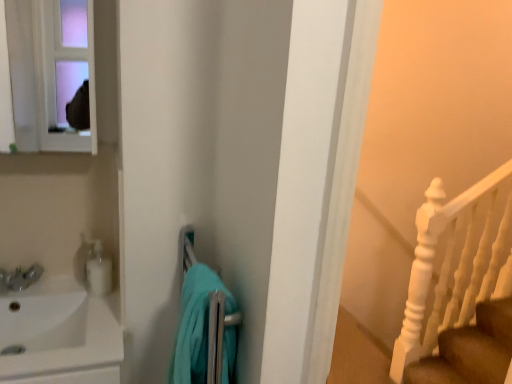
Locate an element on the screen. matte white medicine cabinet at upper left is located at coordinates (49, 72).

The height and width of the screenshot is (384, 512). Describe the element at coordinates (98, 271) in the screenshot. I see `white glossy soap dispenser at left` at that location.

Image resolution: width=512 pixels, height=384 pixels. Describe the element at coordinates (470, 350) in the screenshot. I see `brown wooden stairs at lower right` at that location.

You are a GUI agent. You are given a task and a screenshot of the screen. Output one action in this format:
    pyautogui.click(x=<x>, y=<y>)
    Task: Click on the matte white medicine cabinet at upper left
    Image resolution: width=512 pixels, height=384 pixels.
    Given the screenshot: What is the action you would take?
    pyautogui.click(x=49, y=72)

Can you confirm if brown wooden stairs at lower right is taller than white glossy soap dispenser at left?

Correct, brown wooden stairs at lower right is much taller as white glossy soap dispenser at left.

From the image's perspective, would you say brown wooden stairs at lower right is positioned over white glossy soap dispenser at left?

Actually, brown wooden stairs at lower right appears below white glossy soap dispenser at left in the image.

Between brown wooden stairs at lower right and white glossy soap dispenser at left, which one has larger width?

With larger width is brown wooden stairs at lower right.

Does brown wooden stairs at lower right turn towards white glossy soap dispenser at left?

No, brown wooden stairs at lower right is not oriented towards white glossy soap dispenser at left.

From the image's perspective, does teal fabric towel at center appear higher than matte white medicine cabinet at upper left?

No, from the image's perspective, teal fabric towel at center is not above matte white medicine cabinet at upper left.

Which is in front, teal fabric towel at center or matte white medicine cabinet at upper left?

teal fabric towel at center is in front.

This screenshot has width=512, height=384. I want to click on bath towel below the matte white medicine cabinet at upper left (from a real-world perspective), so click(195, 324).

Is teal fabric towel at center thinner than matte white medicine cabinet at upper left?

No.

Is teal fabric towel at center beside white glossy sink at left?

No, teal fabric towel at center is not next to white glossy sink at left.

From a real-world perspective, which object rests below the other?

white glossy sink at left, from a real-world perspective.

Is teal fabric towel at center facing away from white glossy sink at left?

No.

Can you confirm if teal fabric towel at center is positioned to the left of white glossy sink at left?

In fact, teal fabric towel at center is to the right of white glossy sink at left.

Is matte white medicine cabinet at upper left facing away from teal fabric towel at center?

No, matte white medicine cabinet at upper left is not facing the opposite direction of teal fabric towel at center.

In the scene shown: Which is closer to the camera, (69, 73) or (193, 336)?

Point (69, 73) is farther from the camera than point (193, 336).

From the image's perspective, who appears lower, matte white medicine cabinet at upper left or teal fabric towel at center?

teal fabric towel at center.

Locate an element on the screen. This screenshot has width=512, height=384. stairs on the right of matte white medicine cabinet at upper left is located at coordinates (470, 350).

Is brown wooden stairs at lower right turned away from matte white medicine cabinet at upper left?

That's not correct — brown wooden stairs at lower right is not looking away from matte white medicine cabinet at upper left.

Which object is thinner, brown wooden stairs at lower right or matte white medicine cabinet at upper left?

matte white medicine cabinet at upper left is thinner.

Is matte white medicine cabinet at upper left surrounded by brown wooden stairs at lower right?

Actually, matte white medicine cabinet at upper left is outside brown wooden stairs at lower right.

From a real-world perspective, is matte white medicine cabinet at upper left located beneath white glossy sink at left?

No.

In the scene shown: Does matte white medicine cabinet at upper left have a lesser height compared to white glossy sink at left?

Yes, matte white medicine cabinet at upper left is shorter than white glossy sink at left.

Who is smaller, matte white medicine cabinet at upper left or white glossy sink at left?

With smaller size is matte white medicine cabinet at upper left.

Looking at their sizes, would you say matte white medicine cabinet at upper left is wider or thinner than white glossy sink at left?

matte white medicine cabinet at upper left is thinner than white glossy sink at left.

From the image's perspective, is white glossy sink at left beneath white glossy soap dispenser at left?

Yes.

Considering the relative sizes of white glossy sink at left and white glossy soap dispenser at left in the image provided, is white glossy sink at left wider than white glossy soap dispenser at left?

Yes, white glossy sink at left is wider than white glossy soap dispenser at left.

Considering the positions of objects white glossy sink at left and white glossy soap dispenser at left in the image provided, who is behind, white glossy sink at left or white glossy soap dispenser at left?

white glossy soap dispenser at left is further away from the camera.

Would you say white glossy sink at left is a long distance from white glossy soap dispenser at left?

That's not correct — white glossy sink at left is a little close to white glossy soap dispenser at left.

The height and width of the screenshot is (384, 512). I want to click on toiletry on the left of brown wooden stairs at lower right, so click(x=98, y=271).

This screenshot has width=512, height=384. I want to click on bath towel directly beneath the matte white medicine cabinet at upper left (from a real-world perspective), so click(x=195, y=324).

Looking at the image, which one is located closer to brown wooden stairs at lower right, teal fabric towel at center or white glossy soap dispenser at left?

teal fabric towel at center.

Based on their spatial positions, is brown wooden stairs at lower right or teal fabric towel at center further from white glossy sink at left?

The object further to white glossy sink at left is brown wooden stairs at lower right.

Considering their positions, is teal fabric towel at center positioned further to white glossy soap dispenser at left than matte white medicine cabinet at upper left?

Based on the image, matte white medicine cabinet at upper left appears to be further to white glossy soap dispenser at left.

When comparing their distances from white glossy soap dispenser at left, does teal fabric towel at center or brown wooden stairs at lower right seem closer?

Based on the image, teal fabric towel at center appears to be nearer to white glossy soap dispenser at left.

Based on their spatial positions, is brown wooden stairs at lower right or white glossy sink at left closer to white glossy soap dispenser at left?

white glossy sink at left is positioned closer to the anchor white glossy soap dispenser at left.

When comparing their distances from white glossy sink at left, does brown wooden stairs at lower right or white glossy soap dispenser at left seem further?

brown wooden stairs at lower right is positioned further to the anchor white glossy sink at left.

When comparing their distances from white glossy soap dispenser at left, does matte white medicine cabinet at upper left or teal fabric towel at center seem further?

matte white medicine cabinet at upper left.

Which object lies further to the anchor point white glossy soap dispenser at left, white glossy sink at left or brown wooden stairs at lower right?

brown wooden stairs at lower right lies further to white glossy soap dispenser at left than the other object.

This screenshot has width=512, height=384. What are the coordinates of `toiletry between matte white medicine cabinet at upper left and teal fabric towel at center in the vertical direction` in the screenshot? It's located at (98, 271).

Locate an element on the screen. Image resolution: width=512 pixels, height=384 pixels. toiletry situated between white glossy sink at left and brown wooden stairs at lower right from left to right is located at coordinates (98, 271).

Locate an element on the screen. This screenshot has width=512, height=384. bath towel between white glossy soap dispenser at left and brown wooden stairs at lower right is located at coordinates (195, 324).

At what (x,y) coordinates should I click in order to perform the action: click on sink located between teal fabric towel at center and white glossy soap dispenser at left in the depth direction. Please return your answer as a coordinate pair (x, y). Image resolution: width=512 pixels, height=384 pixels. Looking at the image, I should click on (59, 334).